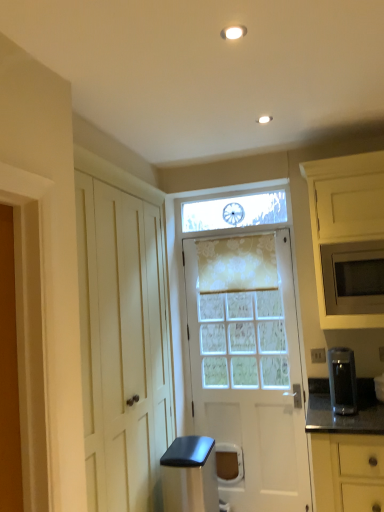
Question: Is satin black trash can at lower center, acting as the 2th appliance starting from the right, not inside floral sheer curtain at center?

Choices:
 (A) yes
 (B) no

Answer: (A)

Question: Does satin black trash can at lower center, which is counted as the first appliance, starting from the bottom, lie behind floral sheer curtain at center?

Choices:
 (A) yes
 (B) no

Answer: (B)

Question: Can you confirm if satin black trash can at lower center, acting as the 2th appliance starting from the right, is thinner than floral sheer curtain at center?

Choices:
 (A) no
 (B) yes

Answer: (A)

Question: Is satin black trash can at lower center, the first appliance from the left, smaller than floral sheer curtain at center?

Choices:
 (A) no
 (B) yes

Answer: (A)

Question: Is satin black trash can at lower center, acting as the 2th appliance starting from the right, with floral sheer curtain at center?

Choices:
 (A) no
 (B) yes

Answer: (A)

Question: From their relative heights in the image, would you say satin black trash can at lower center, arranged as the second appliance when viewed from the top, is taller or shorter than matte white microwave at right, the second cabinetry ordered from the bottom?

Choices:
 (A) short
 (B) tall

Answer: (A)

Question: From a real-world perspective, relative to matte white microwave at right, the second cabinetry ordered from the bottom, is satin black trash can at lower center, acting as the 2th appliance starting from the right, vertically above or below?

Choices:
 (A) below
 (B) above

Answer: (A)

Question: Is satin black trash can at lower center, acting as the 2th appliance starting from the right, in front of or behind matte white microwave at right, which is the 1th cabinetry from top to bottom, in the image?

Choices:
 (A) front
 (B) behind

Answer: (B)

Question: Considering the relative positions of satin black trash can at lower center, which is counted as the first appliance, starting from the bottom, and matte white microwave at right, the second cabinetry ordered from the bottom, in the image provided, is satin black trash can at lower center, which is counted as the first appliance, starting from the bottom, to the left or to the right of matte white microwave at right, the second cabinetry ordered from the bottom,?

Choices:
 (A) right
 (B) left

Answer: (B)

Question: Based on their positions, is satin black coffee maker at right, which is the first appliance in top-to-bottom order, located to the left or right of yellow matte cabinet at lower right, which is counted as the second cabinetry, starting from the top?

Choices:
 (A) right
 (B) left

Answer: (B)

Question: Considering their positions, is satin black coffee maker at right, the first appliance when ordered from right to left, located in front of or behind yellow matte cabinet at lower right, positioned as the 1th cabinetry in bottom-to-top order?

Choices:
 (A) front
 (B) behind

Answer: (B)

Question: Based on their sizes in the image, would you say satin black coffee maker at right, the first appliance when ordered from right to left, is bigger or smaller than yellow matte cabinet at lower right, positioned as the 1th cabinetry in bottom-to-top order?

Choices:
 (A) big
 (B) small

Answer: (B)

Question: Is point (355, 393) positioned closer to the camera than point (339, 432)?

Choices:
 (A) closer
 (B) farther

Answer: (B)

Question: From the image's perspective, relative to satin black coffee maker at right, the first appliance when ordered from right to left, is matte white microwave at right, which is the 1th cabinetry from top to bottom, above or below?

Choices:
 (A) above
 (B) below

Answer: (A)

Question: From a real-world perspective, is matte white microwave at right, the second cabinetry ordered from the bottom, above or below satin black coffee maker at right, which is the first appliance in top-to-bottom order?

Choices:
 (A) below
 (B) above

Answer: (B)